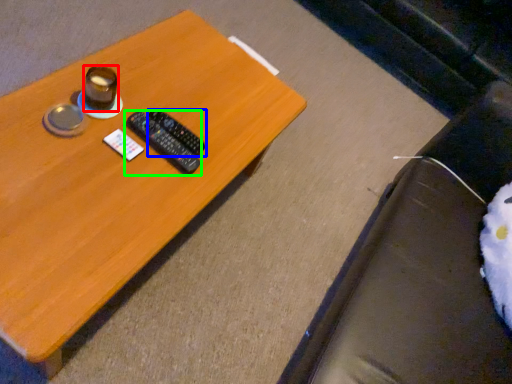
Question: Which object is the farthest from coffee cup (highlighted by a red box)? Choose among these: remote control (highlighted by a blue box) or remote control (highlighted by a green box).

Choices:
 (A) remote control
 (B) remote control

Answer: (A)